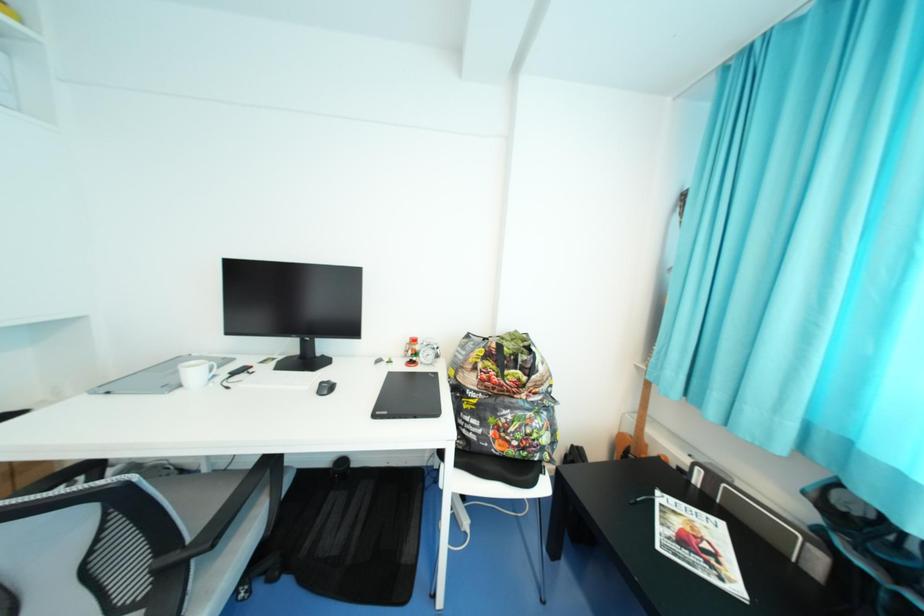
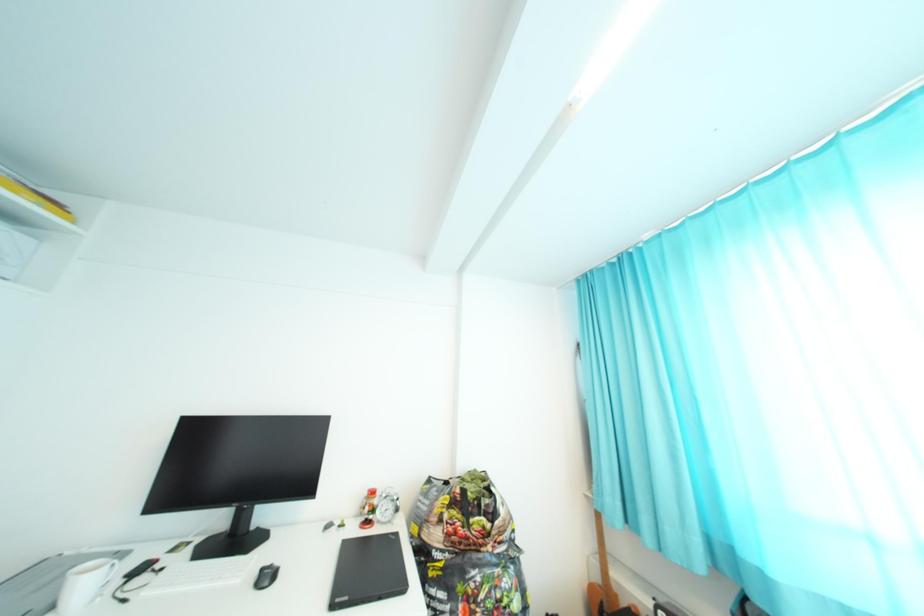
Question: The images are taken continuously from a first-person perspective. In which direction is your viewpoint rotating?

Choices:
 (A) Left
 (B) Right
 (C) Up
 (D) Down

Answer: (C)